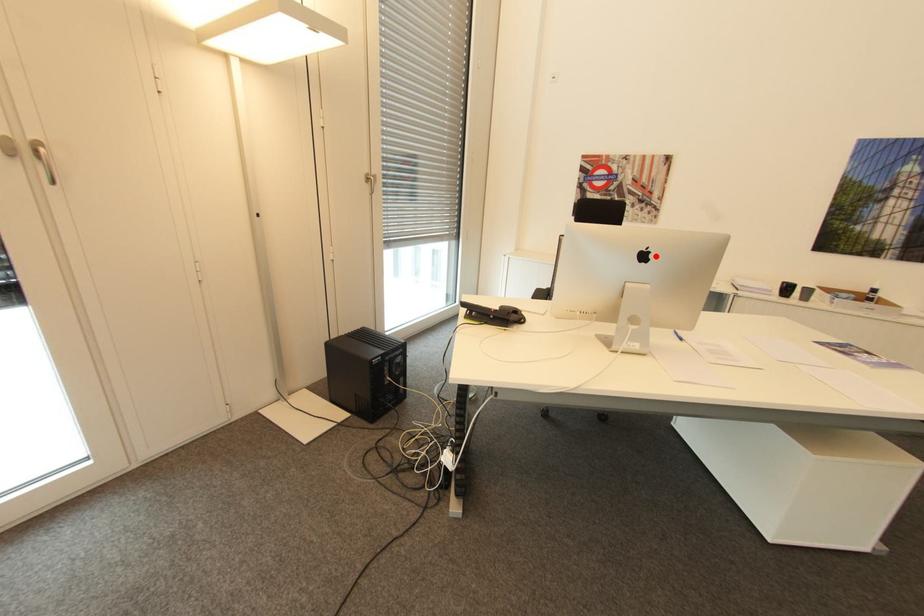
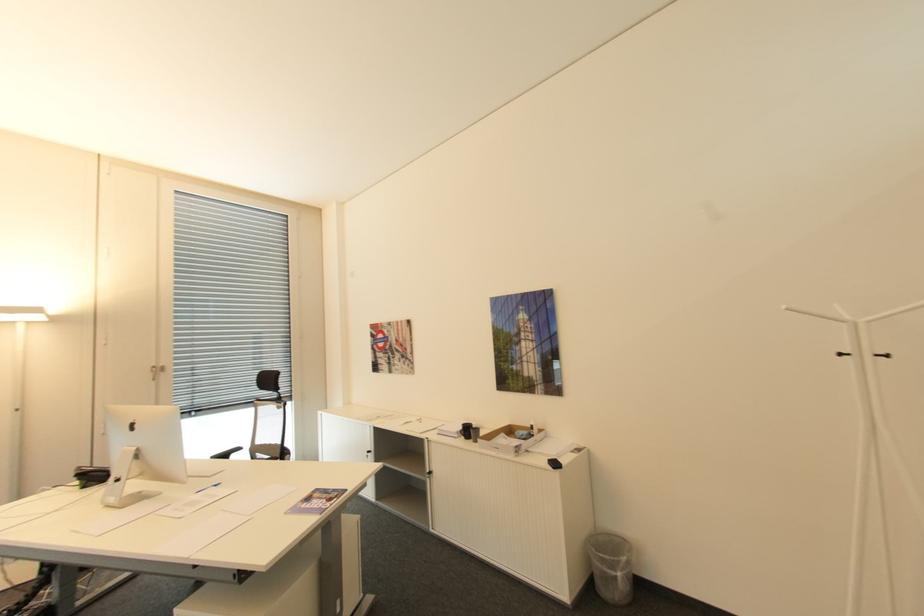
Question: I am providing you with two images of the same scene from different viewpoints. A red point is shown in image1. For the corresponding object point in image2, is it positioned nearer or farther from the camera?

Choices:
 (A) Nearer
 (B) Farther

Answer: (A)